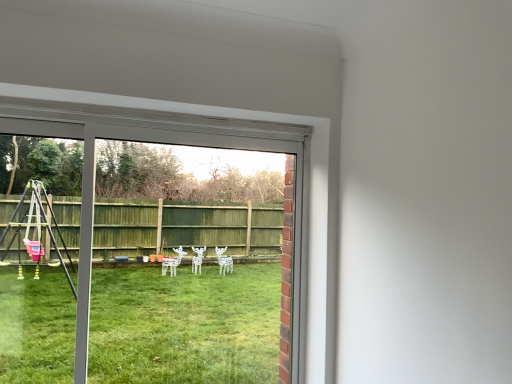
The height and width of the screenshot is (384, 512). Identify the location of clear glass window at upper left. (178, 144).

Describe the element at coordinates (178, 144) in the screenshot. This screenshot has width=512, height=384. I see `clear glass window at upper left` at that location.

Locate an element on the screen. This screenshot has height=384, width=512. clear glass window at upper left is located at coordinates (178, 144).